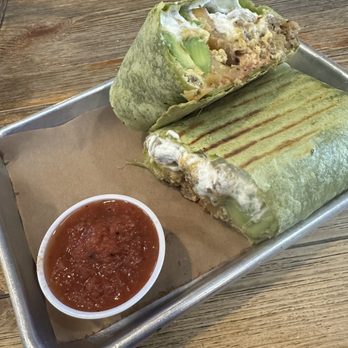
This screenshot has height=348, width=348. Identify the location of tray is diagonal from upper right to lower left. (263, 258).